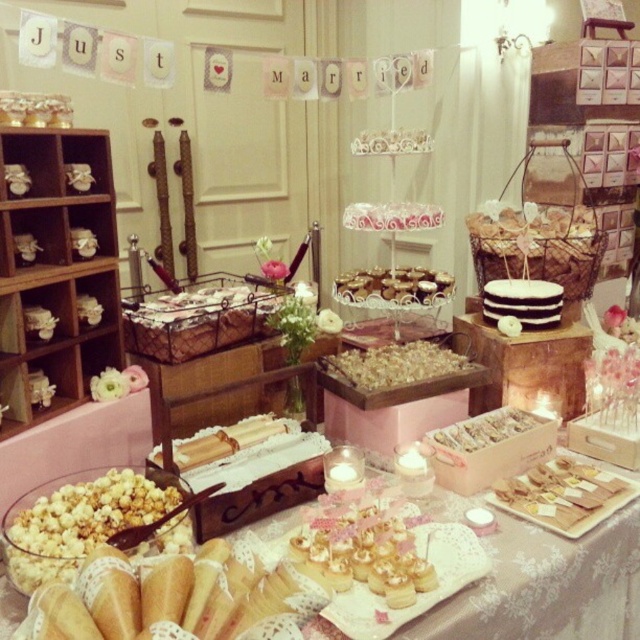
Question: Which of the following is the closest to the observer?

Choices:
 (A) (397, 348)
 (B) (420, 568)

Answer: (B)

Question: Which point appears farthest from the camera in this image?

Choices:
 (A) (387, 275)
 (B) (557, 627)

Answer: (A)

Question: Can you confirm if white lace tablecloth at center is thinner than white popcorn at center?

Choices:
 (A) no
 (B) yes

Answer: (A)

Question: Is matte gold cake at center in front of chocolate frosted cake at center?

Choices:
 (A) no
 (B) yes

Answer: (A)

Question: From the image, what is the correct spatial relationship of white lace tablecloth at center in relation to chocolate frosted cake at center?

Choices:
 (A) above
 (B) below

Answer: (B)

Question: Which point is farther to the camera?

Choices:
 (A) (381, 368)
 (B) (358, 524)
 (C) (499, 310)

Answer: (C)